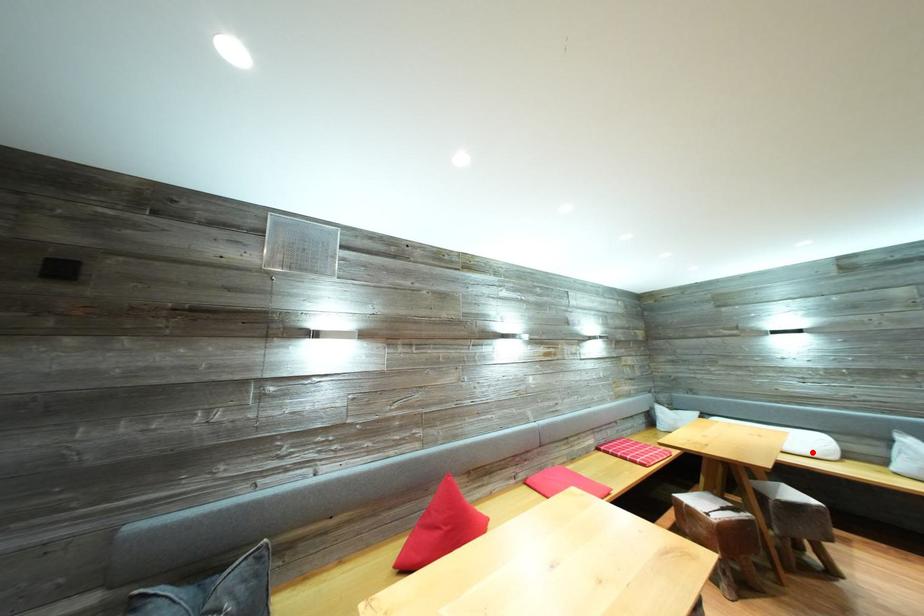
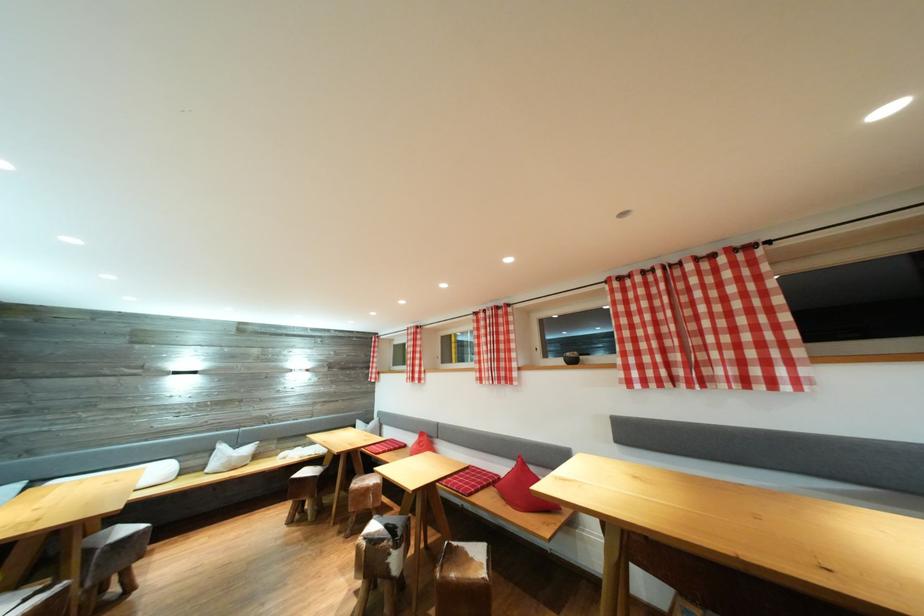
The point at the highlighted location is marked in the first image. Where is the corresponding point in the second image?

(161, 483)